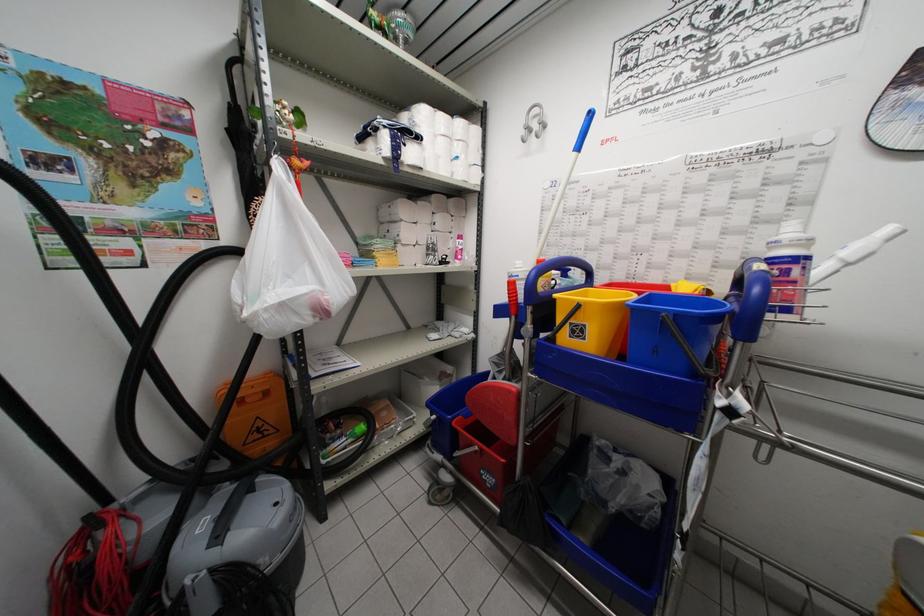
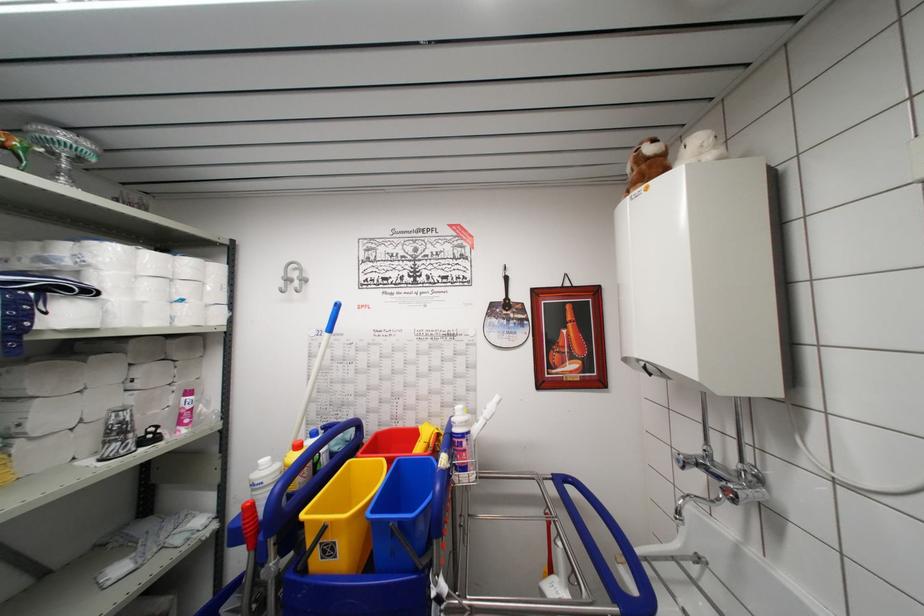
Find the pixel in the second image that matches point 574,341 in the first image.

(325, 562)